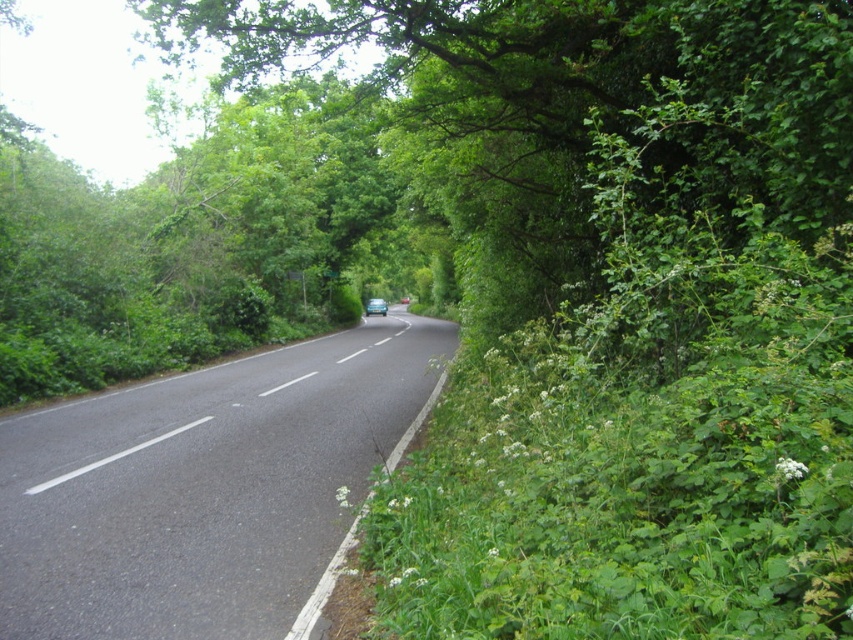
From the picture: You are driving a blue metallic car at center on a two lane road through a forest. You need to make a U turn but there is a black asphalt road at center in front of you. Is there enough space to turn around?

The black asphalt road at center is in front of the blue metallic car at center, so there is no space to turn around as the road is blocked by the asphalt road itself.

You are a driver approaching a forested area with a black asphalt road at center and a blue metallic car at center. Which object is taller from your perspective?

The blue metallic car at center is taller than the black asphalt road at center.

You are a hiker standing at the point with coordinates (202, 486) in the image. What is the color of the surface you are currently standing on?

The surface at point (202, 486) is black asphalt road at center, so the color is black.